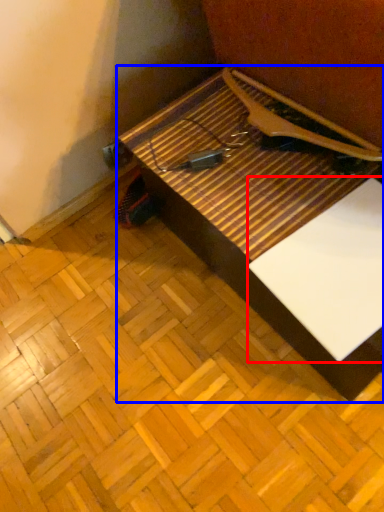
Question: Which point is further to the camera, wide (highlighted by a red box) or table (highlighted by a blue box)?

Choices:
 (A) wide
 (B) table

Answer: (A)